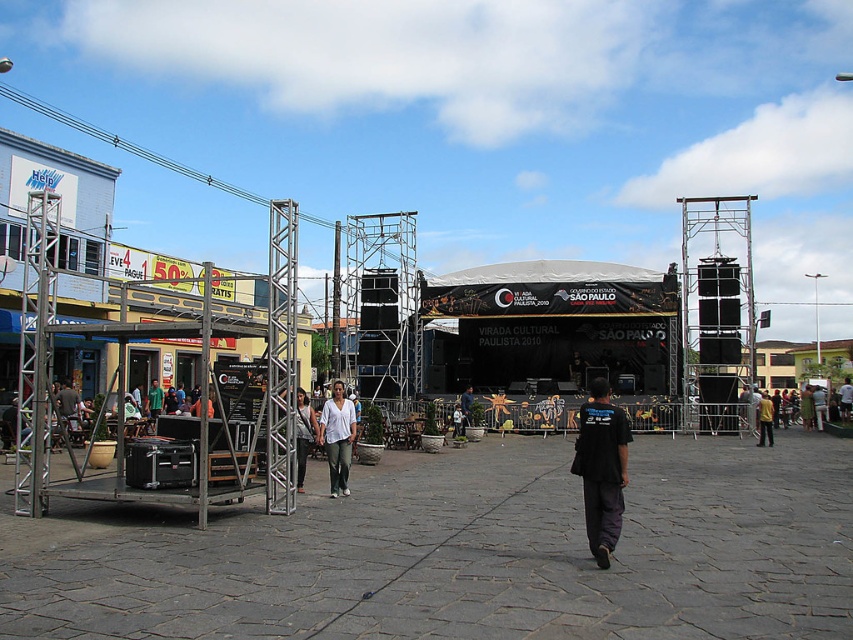
Question: Which of the following is the farthest from the observer?

Choices:
 (A) black matte shirt at center
 (B) matte white shirt at center

Answer: (B)

Question: Which point is closer to the camera?

Choices:
 (A) (811, 400)
 (B) (341, 476)

Answer: (B)

Question: Can you confirm if black matte shirt at center is smaller than white cotton shirt at center?

Choices:
 (A) yes
 (B) no

Answer: (B)

Question: Does black matte shirt at center come behind yellow shirt at center?

Choices:
 (A) yes
 (B) no

Answer: (B)

Question: Which of the following is the closest to the observer?

Choices:
 (A) (759, 445)
 (B) (454, 419)
 (C) (758, 413)

Answer: (A)

Question: Is black matte shirt at center further to the viewer compared to green fabric shirt at center?

Choices:
 (A) no
 (B) yes

Answer: (A)